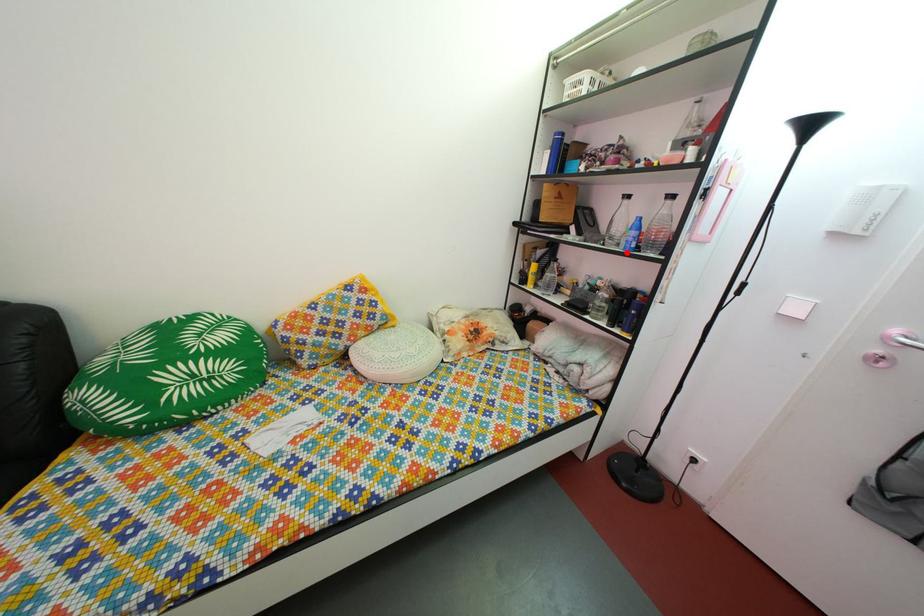
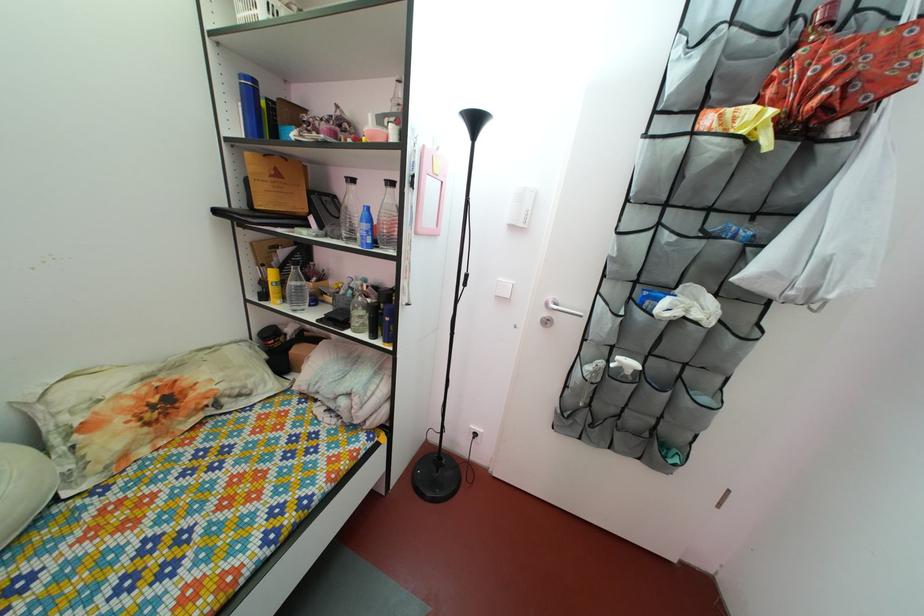
Locate, in the second image, the point that corresponds to the highlighted location in the first image.

(363, 248)